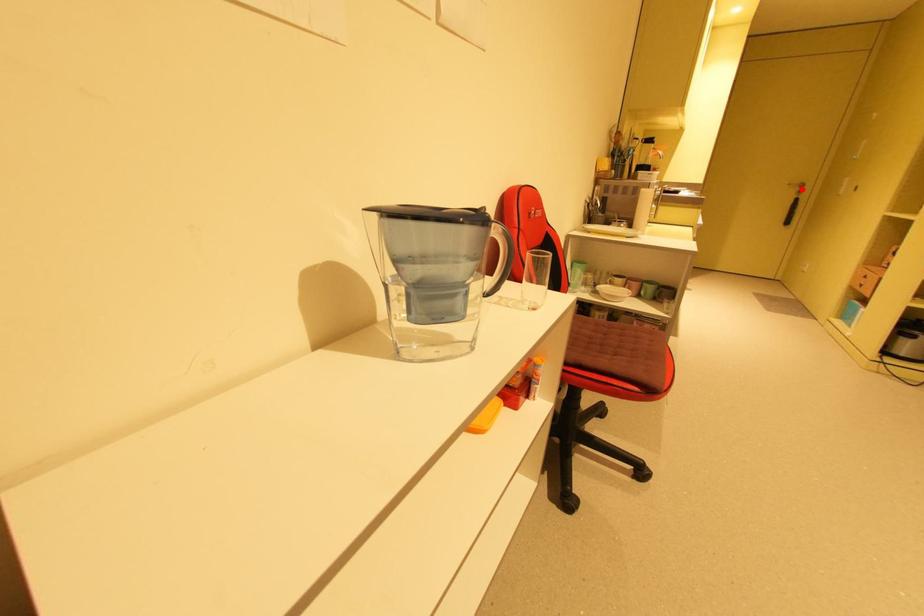
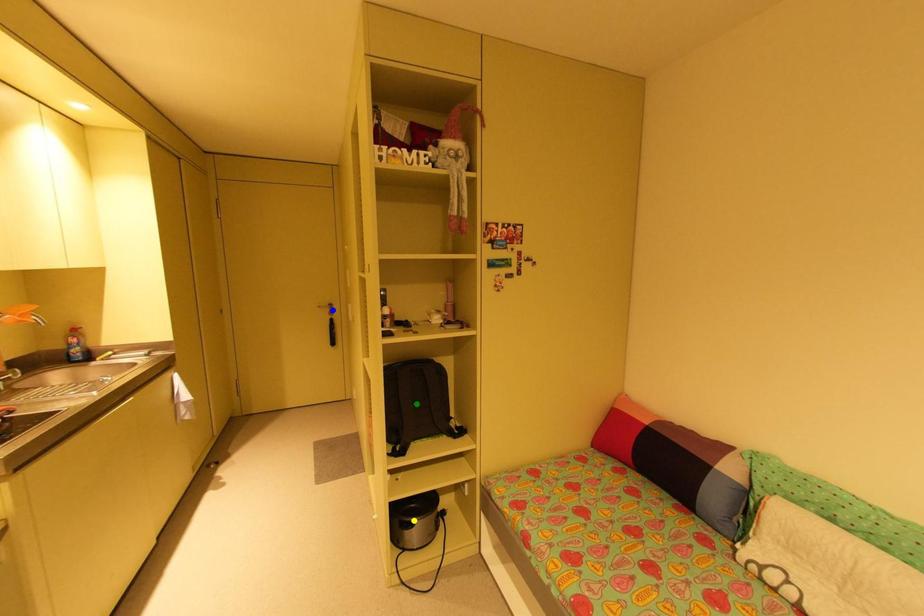
Question: I am providing you with two images of the same scene from different viewpoints. A red point is marked on the first image. You are given multiple points on the second image. Can you choose the point in image 2 that corresponds to the point in image 1?

Choices:
 (A) blue point
 (B) green point
 (C) yellow point

Answer: (A)